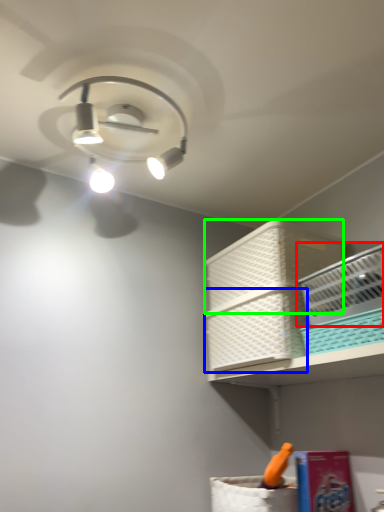
Question: Which object is positioned closest to basket (highlighted by a red box)? Select from basket (highlighted by a blue box) and basket (highlighted by a green box).

Choices:
 (A) basket
 (B) basket

Answer: (A)